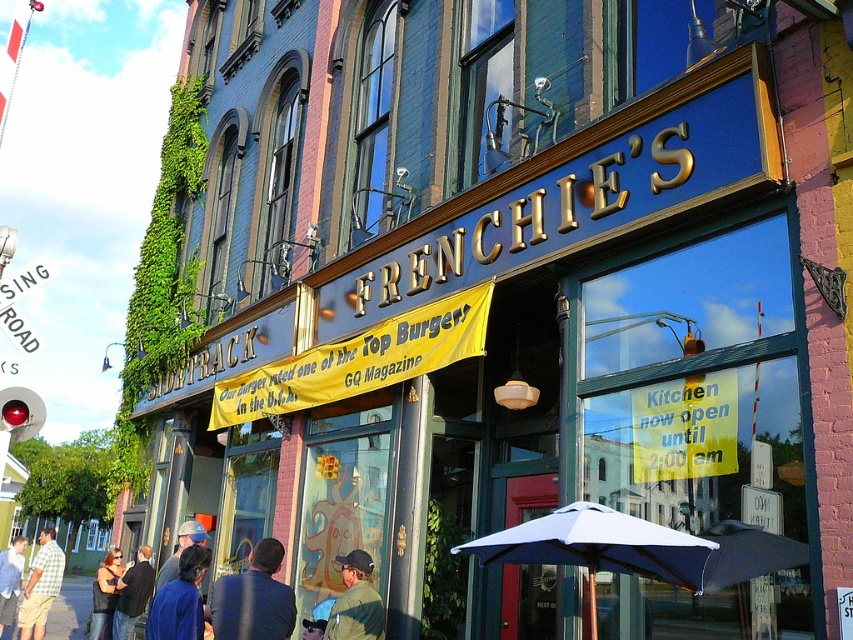
Between green fabric jacket at lower center and denim jacket at lower left, which one is positioned lower?

denim jacket at lower left is below.

Is green fabric jacket at lower center in front of denim jacket at lower left?

Yes, green fabric jacket at lower center is in front of denim jacket at lower left.

Does point (360, 556) lie behind point (6, 588)?

No.

At what (x,y) coordinates should I click in order to perform the action: click on green fabric jacket at lower center. Please return your answer as a coordinate pair (x, y). Looking at the image, I should click on (355, 602).

Does blue suit jacket at center come in front of light blue shirt at lower left?

Yes.

Is blue suit jacket at center below light blue shirt at lower left?

Actually, blue suit jacket at center is above light blue shirt at lower left.

The image size is (853, 640). Identify the location of blue suit jacket at center. (253, 598).

The image size is (853, 640). Find the location of `blue suit jacket at center`. blue suit jacket at center is located at coordinates (253, 598).

Which of these two, white fabric umbrella at center or dark blue shirt at lower left, stands taller?

dark blue shirt at lower left

From the picture: Does white fabric umbrella at center have a lesser width compared to dark blue shirt at lower left?

Incorrect, white fabric umbrella at center's width is not less than dark blue shirt at lower left's.

Image resolution: width=853 pixels, height=640 pixels. What do you see at coordinates (598, 547) in the screenshot?
I see `white fabric umbrella at center` at bounding box center [598, 547].

The height and width of the screenshot is (640, 853). In order to click on white fabric umbrella at center in this screenshot , I will do `click(598, 547)`.